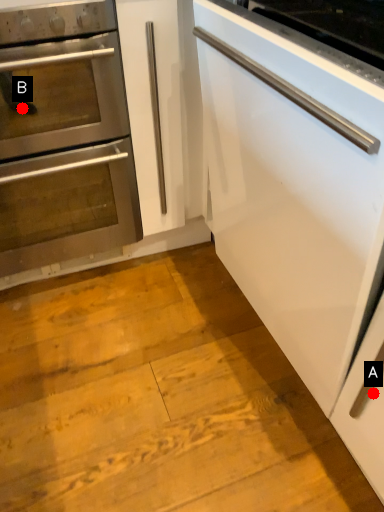
Question: Two points are circled on the image, labeled by A and B beside each circle. Which of the following is the closest to the observer?

Choices:
 (A) A is closer
 (B) B is closer

Answer: (A)